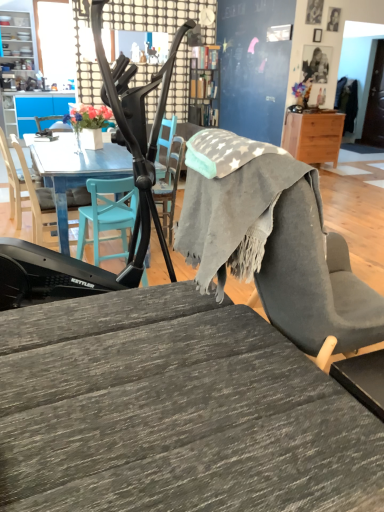
Question: Is matte black chair at center, the 1th chair when ordered from right to left, bigger than wooden desk at right, which is counted as the second desk, starting from the front?

Choices:
 (A) no
 (B) yes

Answer: (A)

Question: Could wooden desk at right, which appears as the 1th desk when viewed from the top, be considered to be inside matte black chair at center, the 1th chair when ordered from right to left?

Choices:
 (A) yes
 (B) no

Answer: (B)

Question: Does matte black chair at center, the 1th chair when ordered from right to left, have a smaller size compared to wooden desk at right, which appears as the 1th desk when viewed from the top?

Choices:
 (A) no
 (B) yes

Answer: (B)

Question: From the image's perspective, would you say matte black chair at center, marked as the 3th chair in a left-to-right arrangement, is shown under wooden desk at right, which ranks as the 1th desk in right-to-left order?

Choices:
 (A) no
 (B) yes

Answer: (B)

Question: Is matte black chair at center, the 1th chair when ordered from right to left, at the left side of wooden desk at right, which appears as the 1th desk when viewed from the top?

Choices:
 (A) no
 (B) yes

Answer: (B)

Question: Is matte white vase at upper left in front of or behind wooden picture frame at upper right, the 2th picture frame in the back-to-front sequence, in the image?

Choices:
 (A) front
 (B) behind

Answer: (A)

Question: Looking at their shapes, would you say matte white vase at upper left is wider or thinner than wooden picture frame at upper right, the 2th picture frame positioned from the bottom?

Choices:
 (A) wide
 (B) thin

Answer: (A)

Question: From the image's perspective, is matte white vase at upper left above or below wooden picture frame at upper right, the 2th picture frame positioned from the bottom?

Choices:
 (A) below
 (B) above

Answer: (A)

Question: Considering the positions of point (77, 143) and point (309, 22), is point (77, 143) closer or farther from the camera than point (309, 22)?

Choices:
 (A) farther
 (B) closer

Answer: (B)

Question: Relative to teal wood chair at left, arranged as the second chair when viewed from the left, is wooden picture frame at upper right, the 2th picture frame positioned from the bottom, in front or behind?

Choices:
 (A) behind
 (B) front

Answer: (A)

Question: Does point (314, 17) appear closer or farther from the camera than point (71, 195)?

Choices:
 (A) farther
 (B) closer

Answer: (A)

Question: Considering the positions of wooden picture frame at upper right, acting as the first picture frame starting from the top, and teal wood chair at left, arranged as the second chair when viewed from the left, in the image, is wooden picture frame at upper right, acting as the first picture frame starting from the top, wider or thinner than teal wood chair at left, arranged as the second chair when viewed from the left,?

Choices:
 (A) wide
 (B) thin

Answer: (B)

Question: Is wooden picture frame at upper right, acting as the first picture frame starting from the top, situated inside teal wood chair at left, arranged as the second chair when viewed from the left, or outside?

Choices:
 (A) outside
 (B) inside

Answer: (A)

Question: Is wooden desk at right, which is counted as the first desk, starting from the back, to the left or to the right of wooden desk at center, marked as the 1th desk in a left-to-right arrangement, in the image?

Choices:
 (A) left
 (B) right

Answer: (B)

Question: Is wooden desk at right, which ranks as the 1th desk in right-to-left order, taller or shorter than wooden desk at center, acting as the 1th desk starting from the bottom?

Choices:
 (A) short
 (B) tall

Answer: (A)